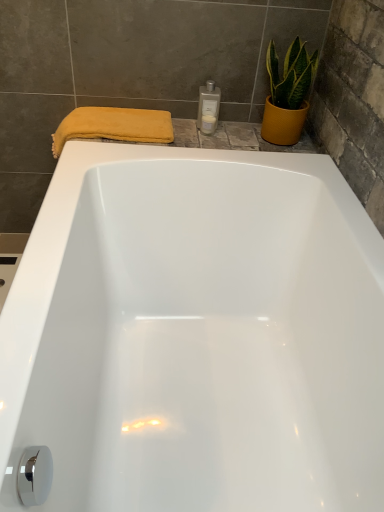
I want to click on free point to the right of white glossy bottle at upper center, which is the first toiletry from bottom to top, so click(243, 136).